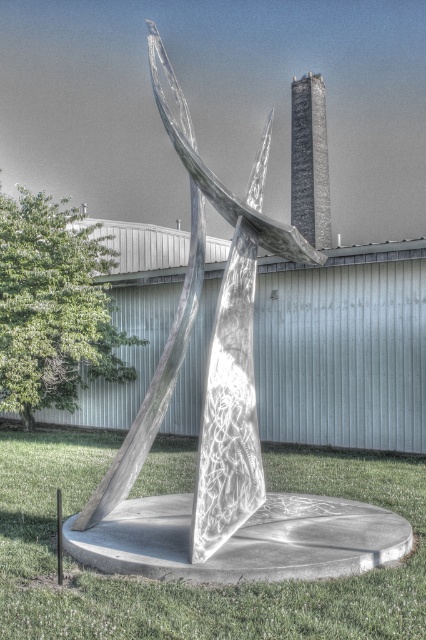
Question: Can you confirm if green grass at center is positioned above shiny metallic sculpture at center?

Choices:
 (A) no
 (B) yes

Answer: (A)

Question: Can you confirm if green grass at center is positioned to the left of shiny metallic sculpture at center?

Choices:
 (A) yes
 (B) no

Answer: (A)

Question: Can you confirm if green grass at center is smaller than shiny metallic sculpture at center?

Choices:
 (A) no
 (B) yes

Answer: (B)

Question: Which of the following is the closest to the observer?

Choices:
 (A) (x=249, y=508)
 (B) (x=379, y=596)

Answer: (B)

Question: Which of the following is the closest to the observer?

Choices:
 (A) shiny metallic sculpture at center
 (B) green grass at center

Answer: (B)